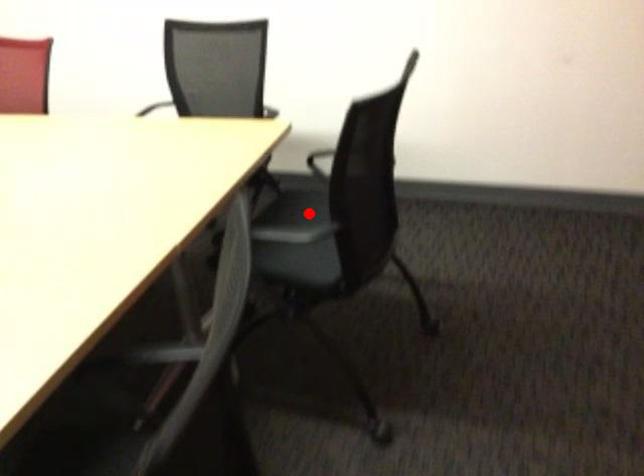
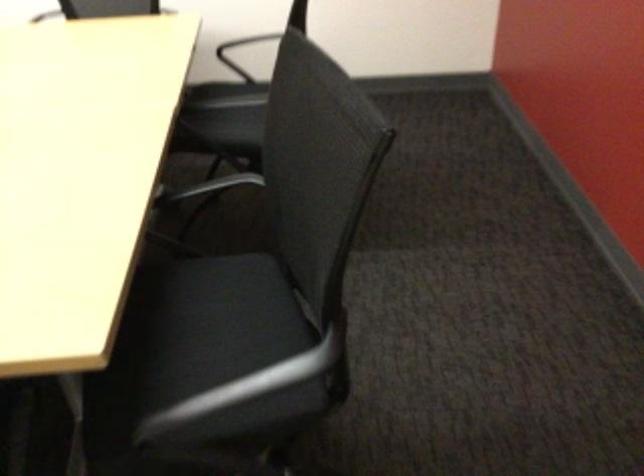
Find the pixel in the second image that matches the highlighted location in the first image.

(230, 101)